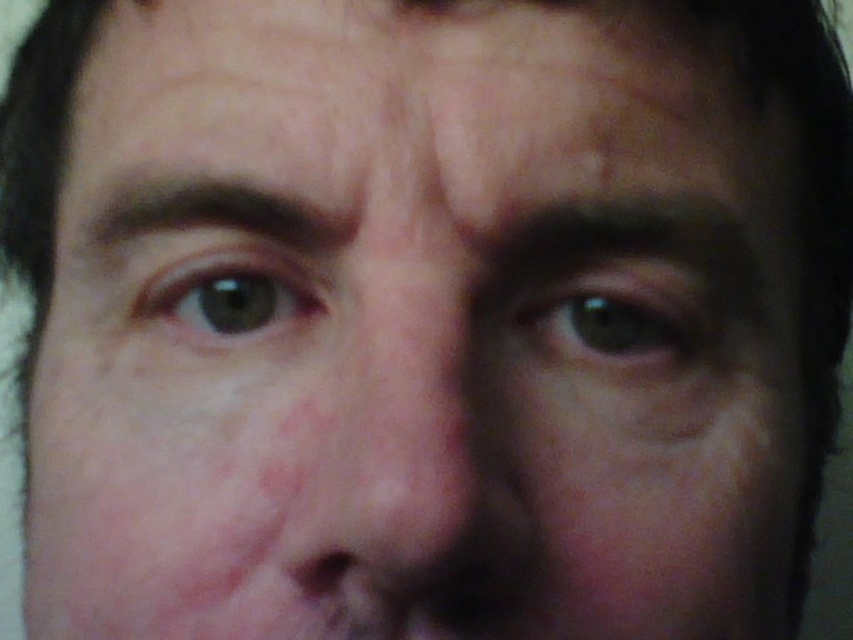
Find the location of a particular element. smooth skin nose at center is located at coordinates (386, 432).

Who is higher up, smooth skin nose at center or green matte eye at center?

Positioned higher is green matte eye at center.

Describe the element at coordinates (386, 432) in the screenshot. I see `smooth skin nose at center` at that location.

Where is `smooth skin nose at center`? This screenshot has height=640, width=853. smooth skin nose at center is located at coordinates (386, 432).

Between smooth skin nose at center and green matte eye at upper left, which one has less height?

green matte eye at upper left

Can you confirm if smooth skin nose at center is wider than green matte eye at upper left?

No.

You are a GUI agent. You are given a task and a screenshot of the screen. Output one action in this format:
    pyautogui.click(x=<x>, y=<y>)
    Task: Click on the smooth skin nose at center
    
    Given the screenshot: What is the action you would take?
    pyautogui.click(x=386, y=432)

Which is more to the right, green matte eye at center or green matte eye at upper left?

Positioned to the right is green matte eye at center.

Can you confirm if green matte eye at center is positioned above green matte eye at upper left?

No, green matte eye at center is not above green matte eye at upper left.

Who is more forward, (624, 305) or (225, 317)?

Positioned in front is point (624, 305).

Locate an element on the screen. The height and width of the screenshot is (640, 853). green matte eye at center is located at coordinates (610, 321).